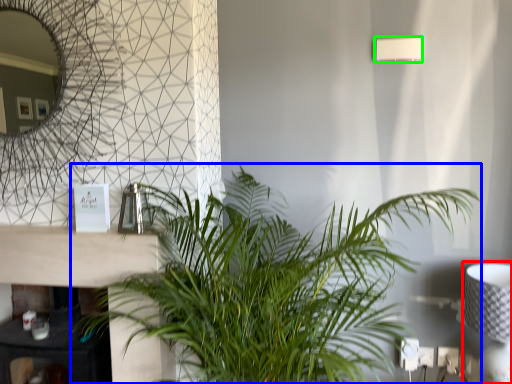
Question: Which is farther away from table lamp (highlighted by a red box)? houseplant (highlighted by a blue box) or lamp (highlighted by a green box)?

Choices:
 (A) houseplant
 (B) lamp

Answer: (B)